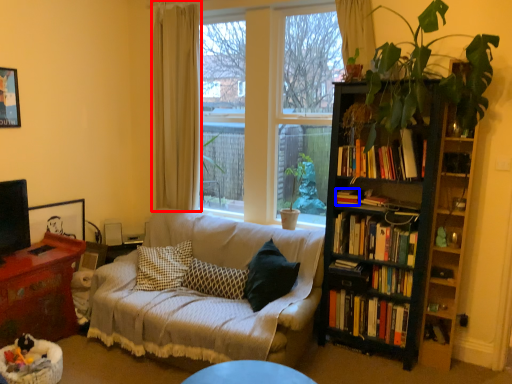
Question: Which of the following is the farthest to the observer, curtain (highlighted by a red box) or book (highlighted by a blue box)?

Choices:
 (A) curtain
 (B) book

Answer: (A)